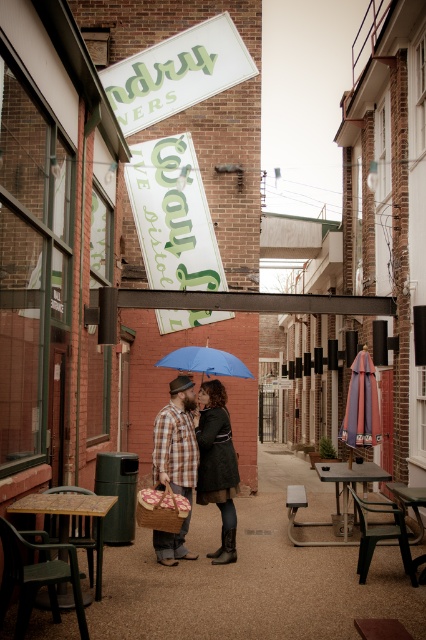
Image resolution: width=426 pixels, height=640 pixels. Describe the element at coordinates (69, 515) in the screenshot. I see `wooden picnic table at lower left` at that location.

Does wooden picnic table at lower left have a lesser width compared to blue matte umbrella at center?

Indeed, wooden picnic table at lower left has a lesser width compared to blue matte umbrella at center.

You are a GUI agent. You are given a task and a screenshot of the screen. Output one action in this format:
    pyautogui.click(x=<x>, y=<y>)
    Task: Click on the wooden picnic table at lower left
    Image resolution: width=426 pixels, height=640 pixels.
    Given the screenshot: What is the action you would take?
    pyautogui.click(x=69, y=515)

Identify the location of wooden picnic table at lower left. (69, 515).

Does point (207, 468) come in front of point (330, 468)?

Yes.

Can you confirm if matte black jacket at center is positioned to the right of metallic silver picnic table at lower right?

Incorrect, matte black jacket at center is not on the right side of metallic silver picnic table at lower right.

Measure the distance between matte black jacket at center and camera.

matte black jacket at center is 7.02 meters from camera.

The height and width of the screenshot is (640, 426). Find the location of `matte black jacket at center`. matte black jacket at center is located at coordinates (216, 465).

You are a GUI agent. You are given a task and a screenshot of the screen. Output one action in this format:
    pyautogui.click(x=<x>, y=<y>)
    Task: Click on the wooden picnic table at lower left
    
    Given the screenshot: What is the action you would take?
    tap(69, 515)

Between wooden picnic table at lower left and metallic silver picnic table at lower right, which one is positioned lower?

metallic silver picnic table at lower right is below.

Who is more forward, (25,500) or (362,468)?

Point (25,500)

Where is `wooden picnic table at lower left`? wooden picnic table at lower left is located at coordinates (69, 515).